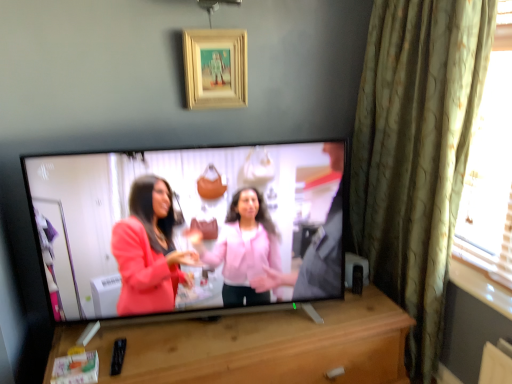
Identify the location of empty space that is ontop of wooden picture frame at upper center (from a real-world perspective). The width and height of the screenshot is (512, 384). (212, 30).